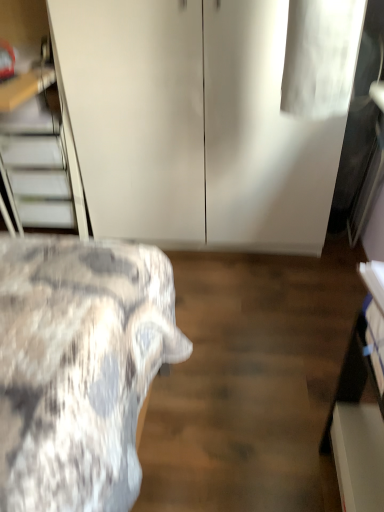
Locate an element on the screen. This screenshot has width=384, height=512. free space in front of white matte cabinet at center is located at coordinates (230, 313).